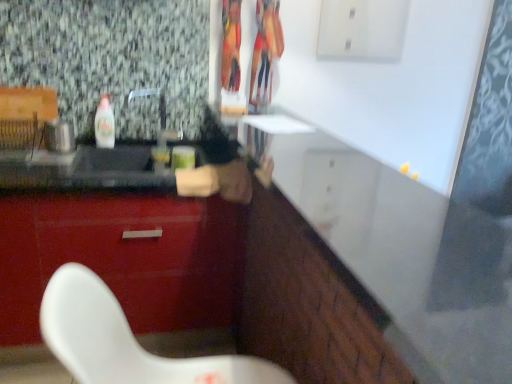
Question: Does clear plastic bottle at left touch white glossy counter at center?

Choices:
 (A) no
 (B) yes

Answer: (A)

Question: From a real-world perspective, is clear plastic bottle at left positioned over white glossy counter at center based on gravity?

Choices:
 (A) no
 (B) yes

Answer: (A)

Question: Considering the relative positions of clear plastic bottle at left and white glossy counter at center in the image provided, is clear plastic bottle at left behind white glossy counter at center?

Choices:
 (A) yes
 (B) no

Answer: (A)

Question: Does clear plastic bottle at left have a lesser width compared to white glossy counter at center?

Choices:
 (A) no
 (B) yes

Answer: (B)

Question: Does clear plastic bottle at left have a lesser height compared to white glossy counter at center?

Choices:
 (A) yes
 (B) no

Answer: (B)

Question: Is clear plastic bottle at left positioned before white glossy counter at center?

Choices:
 (A) no
 (B) yes

Answer: (A)

Question: Considering the relative sizes of glossy red cabinet at lower left and white glossy counter at center in the image provided, is glossy red cabinet at lower left thinner than white glossy counter at center?

Choices:
 (A) no
 (B) yes

Answer: (B)

Question: Is white glossy counter at center at the back of glossy red cabinet at lower left?

Choices:
 (A) no
 (B) yes

Answer: (A)

Question: Is glossy red cabinet at lower left positioned beyond the bounds of white glossy counter at center?

Choices:
 (A) yes
 (B) no

Answer: (A)

Question: Does glossy red cabinet at lower left touch white glossy counter at center?

Choices:
 (A) no
 (B) yes

Answer: (A)

Question: Is glossy red cabinet at lower left to the left of white glossy counter at center from the viewer's perspective?

Choices:
 (A) no
 (B) yes

Answer: (B)

Question: Is the depth of glossy red cabinet at lower left greater than that of white glossy counter at center?

Choices:
 (A) no
 (B) yes

Answer: (B)

Question: Can you confirm if white glossy counter at center is wider than glossy red cabinet at lower left?

Choices:
 (A) no
 (B) yes

Answer: (B)